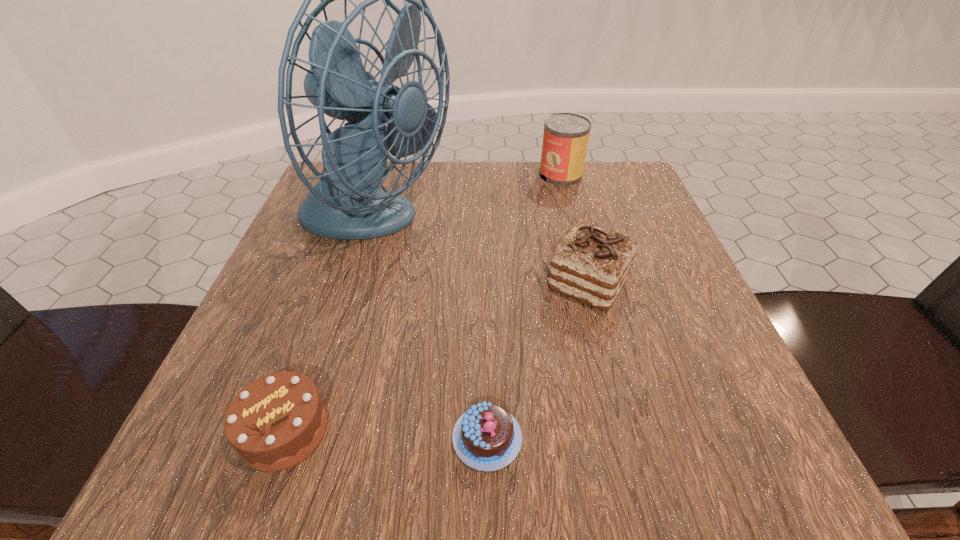
The height and width of the screenshot is (540, 960). I want to click on free spot between the farthest chocolate cake and the second chocolate cake from left to right, so click(538, 361).

Identify the location of free space that is in between the third tallest object and the fan. The height and width of the screenshot is (540, 960). (481, 254).

Image resolution: width=960 pixels, height=540 pixels. What are the coordinates of `free space between the tallest object and the fourth shortest object` in the screenshot? It's located at (468, 200).

This screenshot has width=960, height=540. Identify the location of vacant space that's between the second chocolate cake from right to left and the leftmost chocolate cake. (386, 434).

The image size is (960, 540). I want to click on empty space that is in between the fan and the fourth tallest object, so click(x=329, y=328).

Locate an element on the screen. free area in between the farthest chocolate cake and the shortest object is located at coordinates (538, 361).

This screenshot has height=540, width=960. Find the location of `empty space that is in between the second tallest chocolate cake and the second chocolate cake from right to left`. empty space that is in between the second tallest chocolate cake and the second chocolate cake from right to left is located at coordinates (386, 434).

Identify the location of empty location between the leftmost chocolate cake and the can. (422, 302).

Where is `vacant space that's between the can and the tallest object`? vacant space that's between the can and the tallest object is located at coordinates [468, 200].

Find the location of a particular element. The width and height of the screenshot is (960, 540). object that stands as the fourth closest to the can is located at coordinates (275, 422).